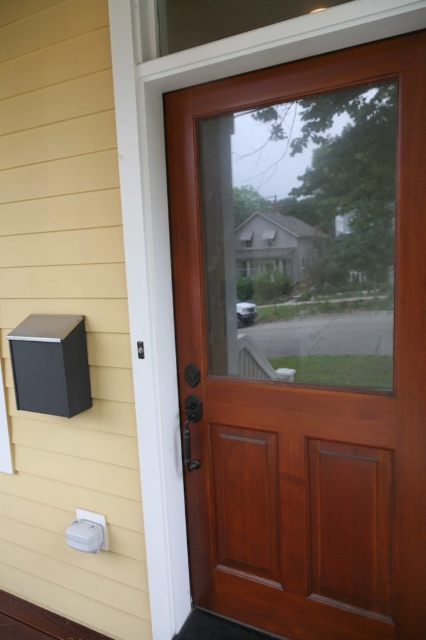
You are a delivery person trying to place a package on the ground near the front door. You see the mahogany wood screen door at center and the yellow siding at left. Which object should you place the package closer to if you want it to be more visible to the homeowner when they open the door?

You should place the package closer to the yellow siding at left because the mahogany wood screen door at center is to the right of it, meaning the yellow siding is on the left side of the door. When the homeowner opens the door, they would naturally see items placed near the left side more easily as they step out.

You are a delivery person trying to attach a package to the yellow siding at left. The package is 2 meters tall. Will the mahogany wood screen door at center block the top part of the package?

The mahogany wood screen door at center has a lesser height compared to yellow siding at left. Since the package is 2 meters tall, the door will not block the top part of the package because the siding is taller than the door.